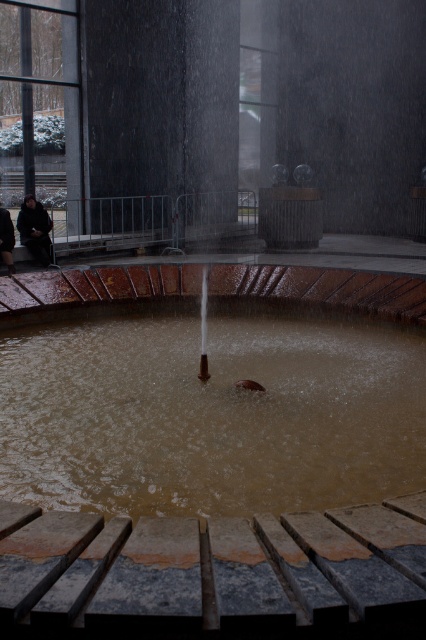
Is the position of black polished stone pillar at upper center more distant than that of dark brown leather jacket at left?

Yes, black polished stone pillar at upper center is behind dark brown leather jacket at left.

Which of these two, black polished stone pillar at upper center or dark brown leather jacket at left, stands shorter?

Standing shorter between the two is black polished stone pillar at upper center.

Which is in front, point (146, 10) or point (20, 218)?

Point (20, 218) is more forward.

Where is `black polished stone pillar at upper center`? black polished stone pillar at upper center is located at coordinates (164, 100).

Can you confirm if black polished stone pillar at upper center is bigger than dark gray coat at left?

No, black polished stone pillar at upper center is not bigger than dark gray coat at left.

Can you confirm if black polished stone pillar at upper center is wider than dark gray coat at left?

No, black polished stone pillar at upper center is not wider than dark gray coat at left.

Is point (206, 109) in front of point (11, 230)?

No, it is not.

This screenshot has height=640, width=426. In order to click on black polished stone pillar at upper center in this screenshot , I will do `click(164, 100)`.

Which is more to the right, brown matte water at center or dark brown leather jacket at left?

brown matte water at center is more to the right.

Which is below, brown matte water at center or dark brown leather jacket at left?

brown matte water at center is below.

Find the location of a particular element. brown matte water at center is located at coordinates (210, 410).